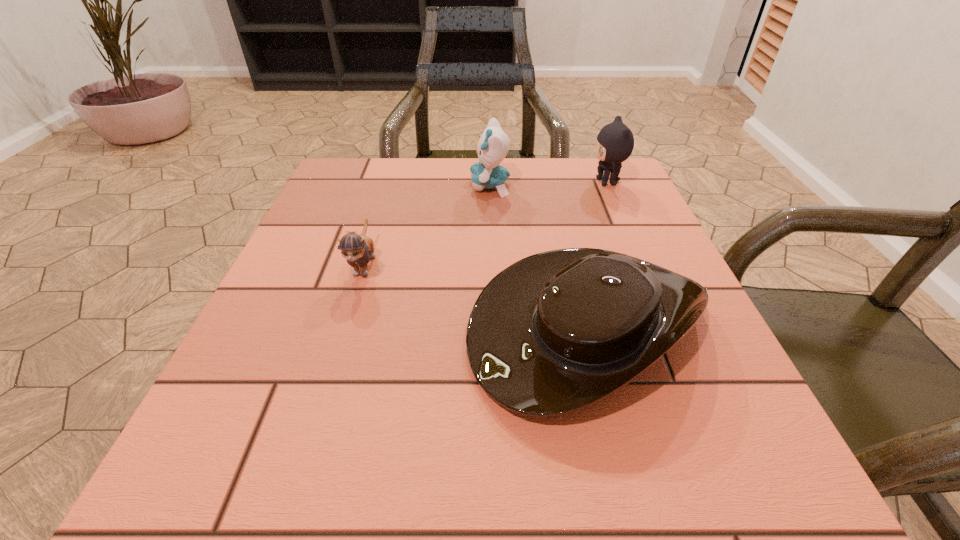
Identify the location of vacant space situated 0.250m on the front-facing side of the rightmost kitten. (484, 182).

Where is `vacant space located on the front-facing side of the shortest kitten`? The image size is (960, 540). vacant space located on the front-facing side of the shortest kitten is located at coordinates (x=331, y=369).

Find the location of a particular element. vacant region located 0.280m on the back of the cowboy hat is located at coordinates pyautogui.click(x=550, y=180).

Where is `object at the left edge`? This screenshot has height=540, width=960. object at the left edge is located at coordinates (358, 249).

In order to click on kitten situated at the right edge in this screenshot , I will do `click(615, 142)`.

Where is `cowboy hat located in the right edge section of the desktop`? This screenshot has width=960, height=540. cowboy hat located in the right edge section of the desktop is located at coordinates (555, 332).

Locate an element on the screen. The width and height of the screenshot is (960, 540). object at the far right corner is located at coordinates (615, 142).

This screenshot has height=540, width=960. What are the coordinates of `blank space at the far edge of the desktop` in the screenshot? It's located at (516, 168).

The height and width of the screenshot is (540, 960). In the image, there is a desktop. Find the location of `free space at the near edge`. free space at the near edge is located at coordinates (538, 440).

This screenshot has height=540, width=960. What are the coordinates of `vacant space at the left edge of the desktop` in the screenshot? It's located at (305, 220).